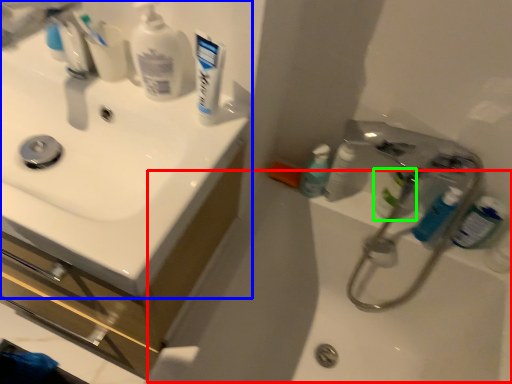
Question: Which object is the farthest from bath (highlighted by a red box)? Choose among these: sink (highlighted by a blue box) or mouthwash (highlighted by a green box).

Choices:
 (A) sink
 (B) mouthwash

Answer: (A)